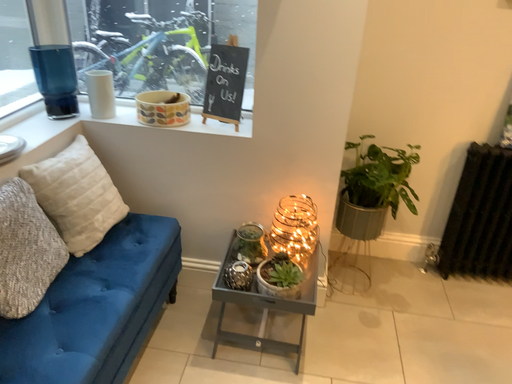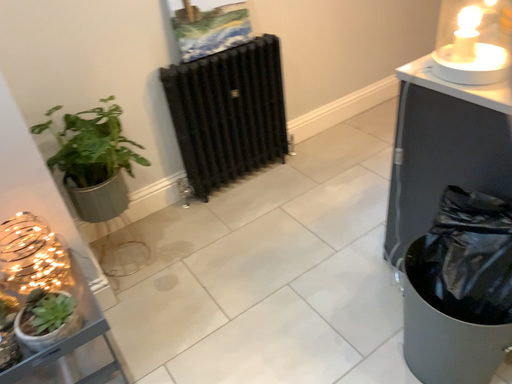
Question: Which way did the camera rotate in the video?

Choices:
 (A) rotated left
 (B) rotated right

Answer: (B)